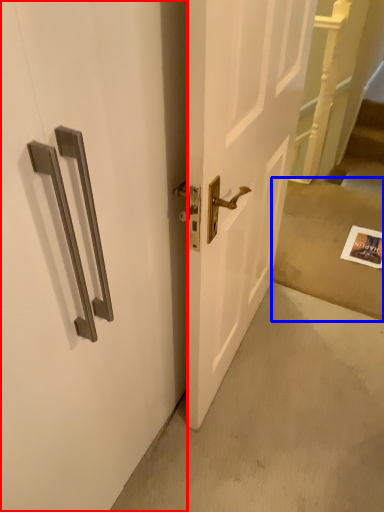
Question: Which object appears closest to the camera in this image, door (highlighted by a red box) or concrete (highlighted by a blue box)?

Choices:
 (A) door
 (B) concrete

Answer: (A)